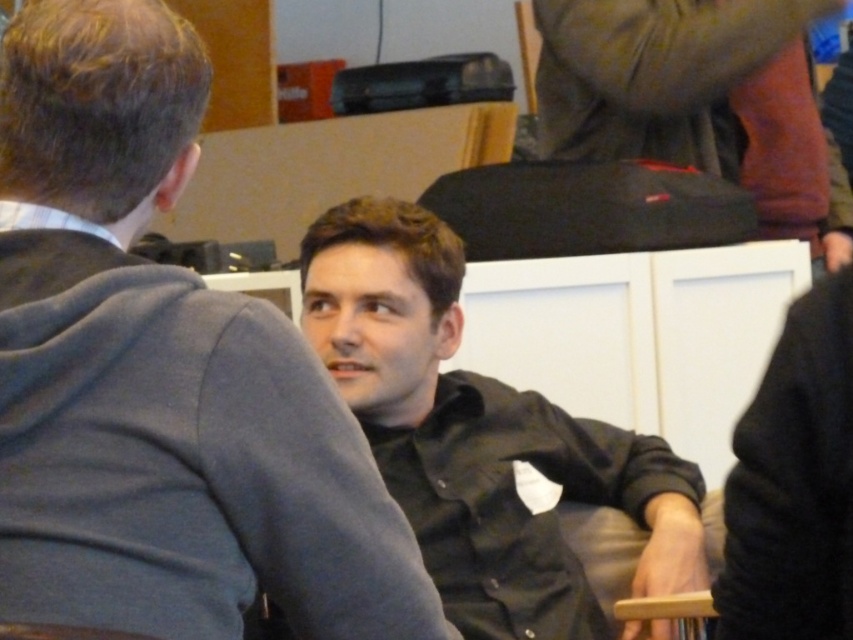
Is black shirt at center taller than black matte shirt at center?

In fact, black shirt at center may be shorter than black matte shirt at center.

Who is taller, black shirt at center or black matte shirt at center?

black matte shirt at center is taller.

Locate an element on the screen. Image resolution: width=853 pixels, height=640 pixels. black shirt at center is located at coordinates (161, 376).

Between black shirt at center and dark gray fabric pants at upper right, which one is positioned lower?

black shirt at center is lower down.

This screenshot has width=853, height=640. Find the location of `black shirt at center`. black shirt at center is located at coordinates (161, 376).

The height and width of the screenshot is (640, 853). In order to click on black shirt at center in this screenshot , I will do click(161, 376).

Who is more forward, (467, 604) or (755, 49)?

Point (467, 604) is more forward.

Is black matte shirt at center further to camera compared to dark gray fabric pants at upper right?

No, it is not.

In order to click on black matte shirt at center in this screenshot , I will do `click(480, 436)`.